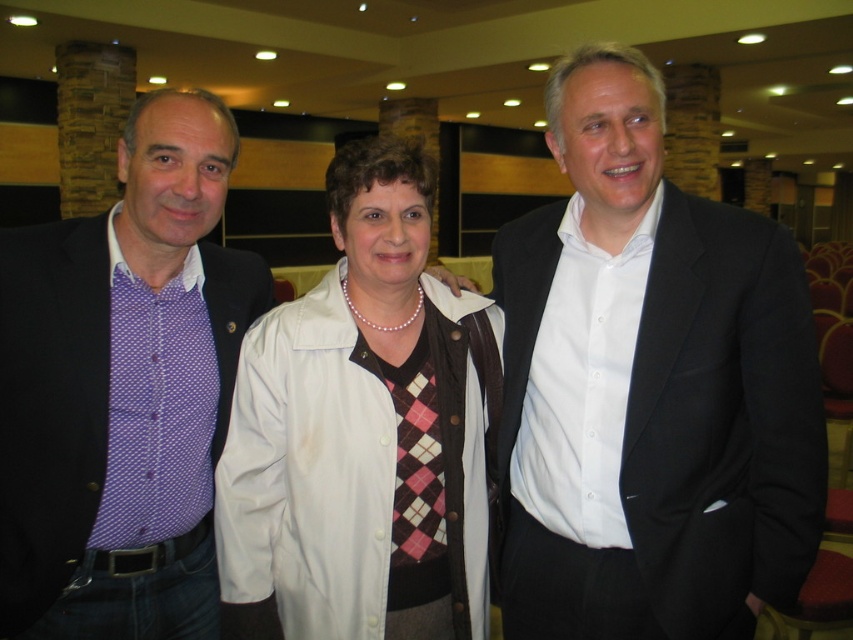
Is black matte suit at center smaller than purple dotted shirt at left?

Actually, black matte suit at center might be larger than purple dotted shirt at left.

In the scene shown: Is black matte suit at center wider than purple dotted shirt at left?

Correct, the width of black matte suit at center exceeds that of purple dotted shirt at left.

Is point (581, 400) farther from camera compared to point (68, 244)?

No, (581, 400) is in front of (68, 244).

At what (x,y) coordinates should I click in order to perform the action: click on black matte suit at center. Please return your answer as a coordinate pair (x, y). This screenshot has height=640, width=853. Looking at the image, I should click on (648, 387).

Based on the photo, between purple dotted shirt at left and white leather jacket at center, which one is positioned lower?

white leather jacket at center is lower down.

Is purple dotted shirt at left closer to camera compared to white leather jacket at center?

That is False.

Image resolution: width=853 pixels, height=640 pixels. In order to click on purple dotted shirt at left in this screenshot , I will do `click(122, 388)`.

Does black matte suit at center have a larger size compared to white leather jacket at center?

Yes, black matte suit at center is bigger than white leather jacket at center.

Is black matte suit at center wider than white leather jacket at center?

Correct, the width of black matte suit at center exceeds that of white leather jacket at center.

Describe the element at coordinates (648, 387) in the screenshot. The height and width of the screenshot is (640, 853). I see `black matte suit at center` at that location.

Find the location of `black matte suit at center`. black matte suit at center is located at coordinates (648, 387).